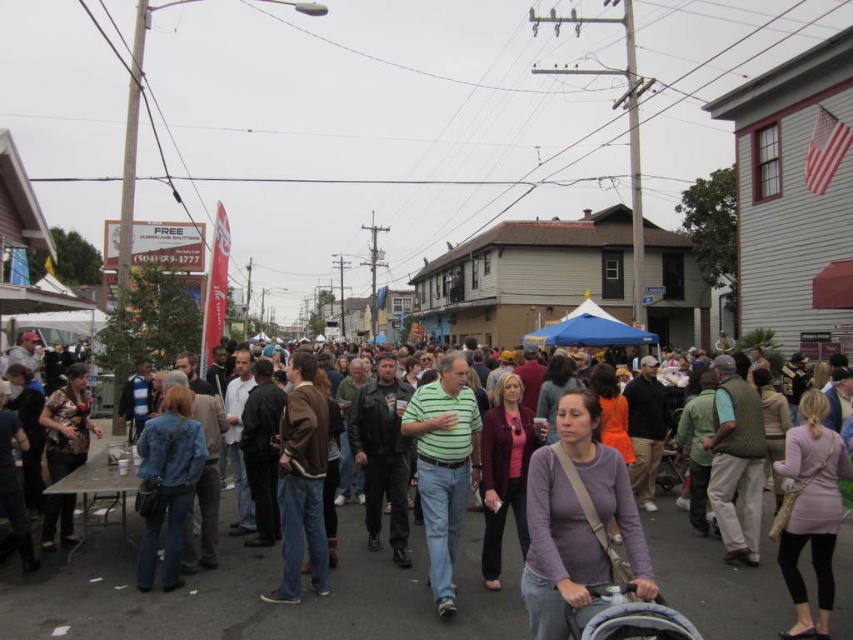
Question: Can you confirm if matte black stroller at center is positioned above green striped shirt at center?

Choices:
 (A) no
 (B) yes

Answer: (A)

Question: Does purple matte sweater at center appear over gray fabric baby carriage at lower right?

Choices:
 (A) no
 (B) yes

Answer: (B)

Question: Which point appears farthest from the camera in this image?

Choices:
 (A) (666, 620)
 (B) (447, 368)

Answer: (B)

Question: Which point is farther from the camera taking this photo?

Choices:
 (A) (590, 634)
 (B) (561, 532)
 (C) (473, 602)
 (D) (445, 560)

Answer: (D)

Question: Does purple matte sweater at center have a smaller size compared to gray fabric baby carriage at lower right?

Choices:
 (A) no
 (B) yes

Answer: (A)

Question: Which point appears closest to the camera in this image?

Choices:
 (A) (555, 516)
 (B) (453, 531)

Answer: (A)